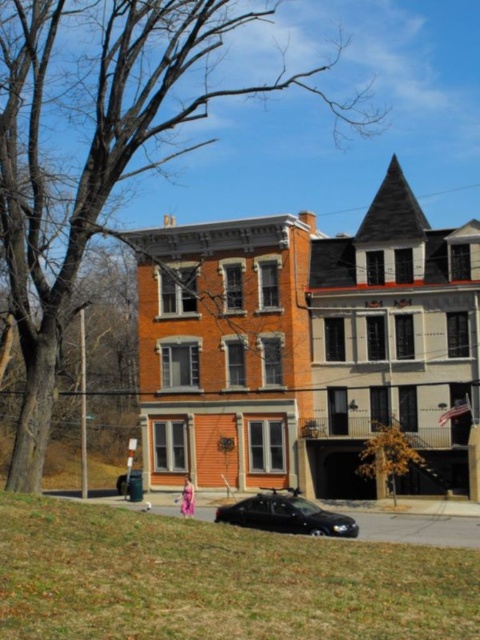
Question: Which object is farther from the camera taking this photo?

Choices:
 (A) green grass at lower left
 (B) shiny black sedan at center

Answer: (B)

Question: Can you confirm if green grass at lower left is wider than shiny black sedan at center?

Choices:
 (A) yes
 (B) no

Answer: (A)

Question: Among these points, which one is nearest to the camera?

Choices:
 (A) (254, 513)
 (B) (63, 630)

Answer: (B)

Question: Is green grass at lower left to the left of shiny black sedan at center from the viewer's perspective?

Choices:
 (A) no
 (B) yes

Answer: (B)

Question: Is green grass at lower left to the right of shiny black sedan at center from the viewer's perspective?

Choices:
 (A) yes
 (B) no

Answer: (B)